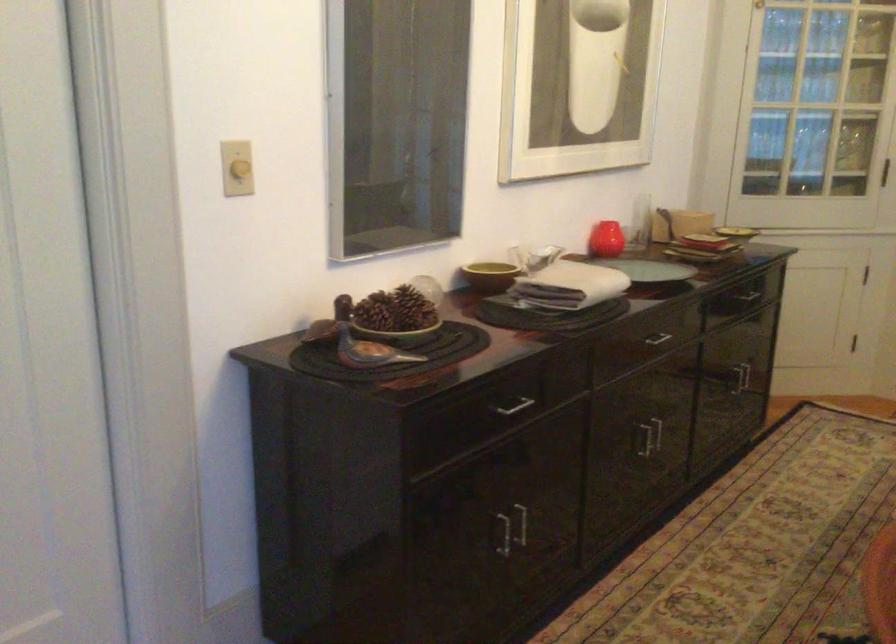
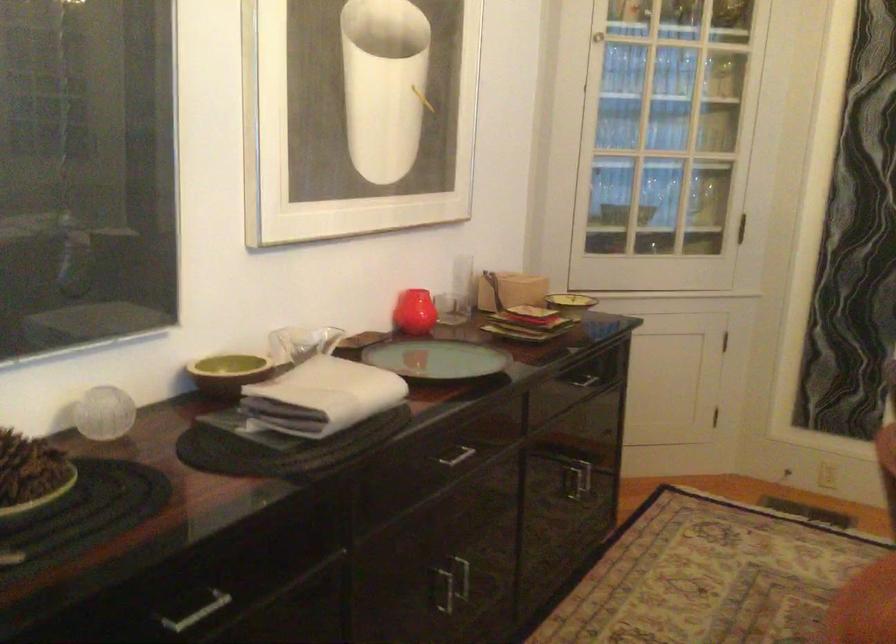
Where in the second image is the point corresponding to point 415,310 from the first image?

(30, 475)